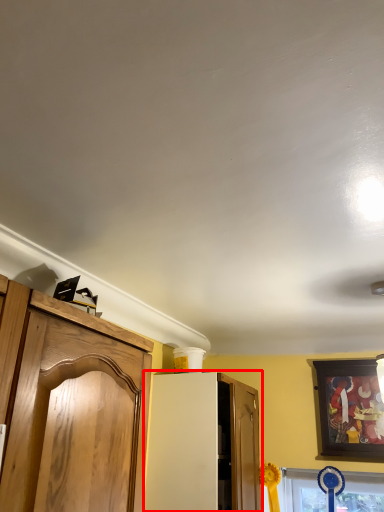
Question: From the image's perspective, what is the correct spatial positioning of cabinetry (annotated by the red box) in reference to picture frame?

Choices:
 (A) below
 (B) above

Answer: (A)